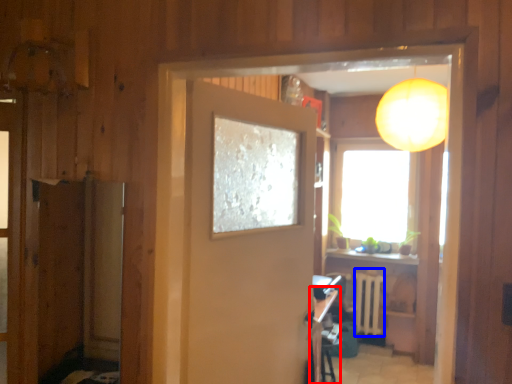
Question: Which of the following is the closest to the observer, table (highlighted by a red box) or radiator (highlighted by a blue box)?

Choices:
 (A) table
 (B) radiator

Answer: (A)